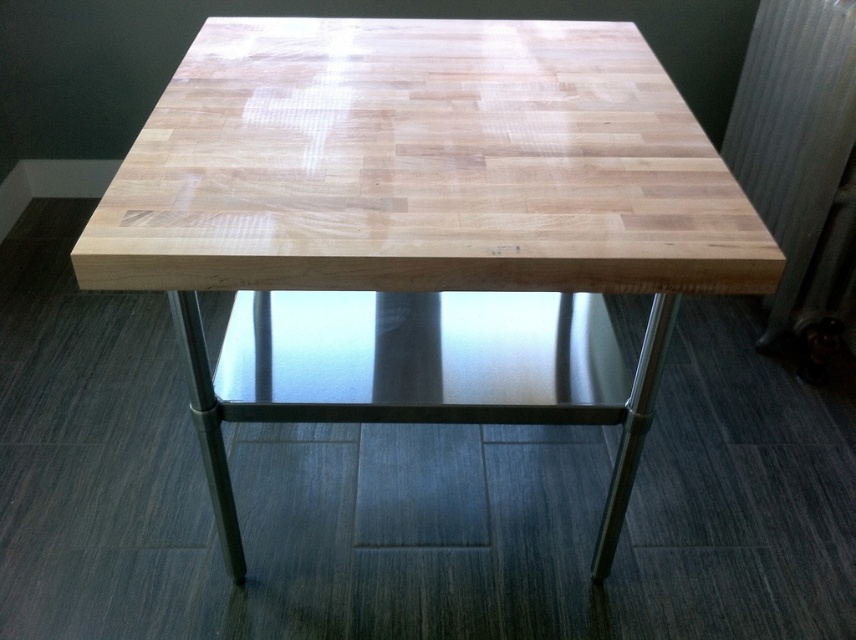
Question: Is natural wood table at center above metallic silver radiator at right?

Choices:
 (A) no
 (B) yes

Answer: (A)

Question: Does natural wood table at center have a larger size compared to metallic silver stool at center?

Choices:
 (A) no
 (B) yes

Answer: (B)

Question: Which point is closer to the camera?

Choices:
 (A) (782, 109)
 (B) (621, 472)
 (C) (257, 406)

Answer: (C)

Question: Which object appears closest to the camera in this image?

Choices:
 (A) natural wood table at center
 (B) metallic silver stool at center
 (C) metallic silver radiator at right

Answer: (A)

Question: Is natural wood table at center smaller than metallic silver radiator at right?

Choices:
 (A) yes
 (B) no

Answer: (B)

Question: Which of the following is the farthest from the observer?

Choices:
 (A) natural wood table at center
 (B) metallic silver radiator at right
 (C) metallic silver stool at center

Answer: (B)